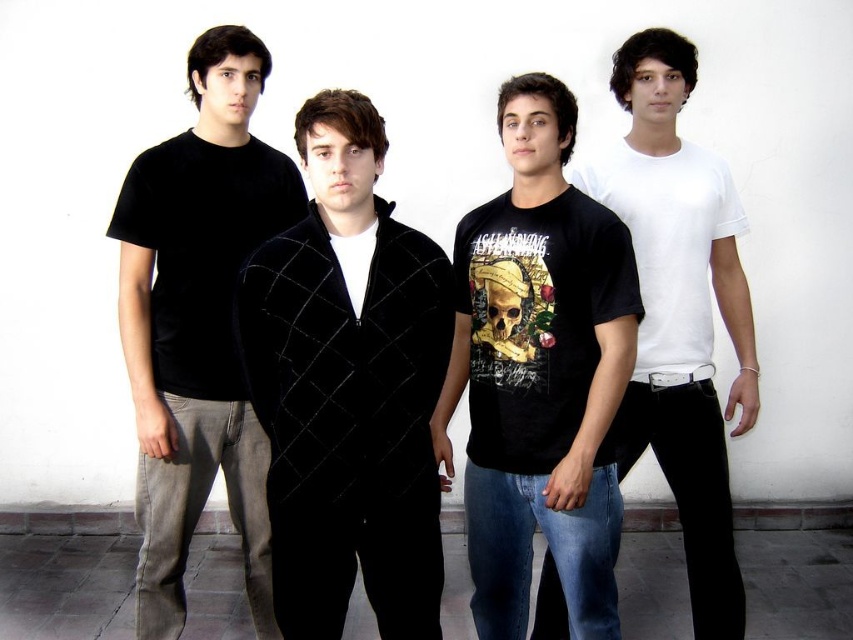
Who is positioned more to the left, velvet black jacket at center or black matte t-shirt at center?

From the viewer's perspective, velvet black jacket at center appears more on the left side.

Between velvet black jacket at center and black matte t-shirt at center, which one has less height?

Standing shorter between the two is velvet black jacket at center.

The image size is (853, 640). What are the coordinates of `velvet black jacket at center` in the screenshot? It's located at (347, 387).

From the picture: Which of these two, velvet black jacket at center or white matte t-shirt at center, stands shorter?

Standing shorter between the two is velvet black jacket at center.

The width and height of the screenshot is (853, 640). What do you see at coordinates (347, 387) in the screenshot? I see `velvet black jacket at center` at bounding box center [347, 387].

Where is `velvet black jacket at center`? The height and width of the screenshot is (640, 853). velvet black jacket at center is located at coordinates (347, 387).

Is black matte t-shirt at center to the left of white matte t-shirt at center from the viewer's perspective?

Correct, you'll find black matte t-shirt at center to the left of white matte t-shirt at center.

Which is in front, point (476, 326) or point (651, 300)?

Point (476, 326)

I want to click on black matte t-shirt at center, so click(538, 372).